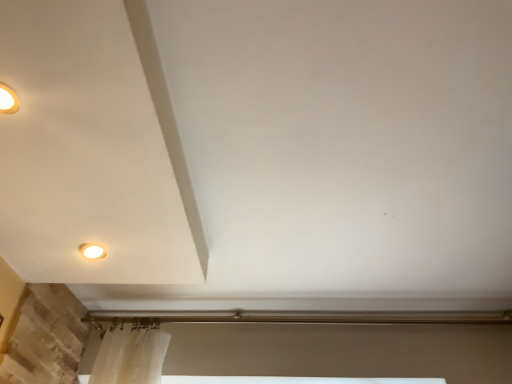
In order to face white glossy light fixture at upper left, should I rotate leftwards or rightwards?

It's best to rotate left around 30.894 degrees.

What are the coordinates of `white glossy light fixture at upper left` in the screenshot? It's located at (8, 100).

What do you see at coordinates (8, 100) in the screenshot? Image resolution: width=512 pixels, height=384 pixels. I see `white glossy light fixture at upper left` at bounding box center [8, 100].

Identify the location of matte white lamp at lower left. Image resolution: width=512 pixels, height=384 pixels. (92, 251).

What do you see at coordinates (92, 251) in the screenshot? I see `matte white lamp at lower left` at bounding box center [92, 251].

Measure the distance between point (89, 251) and camera.

Point (89, 251) is 1.28 meters away from camera.

You are a GUI agent. You are given a task and a screenshot of the screen. Output one action in this format:
    pyautogui.click(x=<x>, y=<y>)
    Task: Click on the white glossy light fixture at upper left
    
    Given the screenshot: What is the action you would take?
    pyautogui.click(x=8, y=100)

Considering the relative positions of matte white lamp at lower left and white glossy light fixture at upper left in the image provided, is matte white lamp at lower left to the left of white glossy light fixture at upper left from the viewer's perspective?

No, matte white lamp at lower left is not to the left of white glossy light fixture at upper left.

Which object is further away from the camera taking this photo, matte white lamp at lower left or white glossy light fixture at upper left?

matte white lamp at lower left.

Considering the positions of points (87, 250) and (1, 84), is point (87, 250) farther from camera compared to point (1, 84)?

Yes, it is.

From the image's perspective, which one is positioned higher, matte white lamp at lower left or white glossy light fixture at upper left?

white glossy light fixture at upper left, from the image's perspective.

From a real-world perspective, which is physically below, matte white lamp at lower left or white glossy light fixture at upper left?

white glossy light fixture at upper left is physically lower.

In terms of width, does matte white lamp at lower left look wider or thinner when compared to white glossy light fixture at upper left?

Clearly, matte white lamp at lower left has less width compared to white glossy light fixture at upper left.

Consider the image. Can you confirm if matte white lamp at lower left is shorter than white glossy light fixture at upper left?

No, matte white lamp at lower left is not shorter than white glossy light fixture at upper left.

Can you confirm if matte white lamp at lower left is smaller than white glossy light fixture at upper left?

Yes.

Is matte white lamp at lower left spatially inside white glossy light fixture at upper left, or outside of it?

matte white lamp at lower left is spatially situated outside white glossy light fixture at upper left.

Are matte white lamp at lower left and white glossy light fixture at upper left making contact?

No, matte white lamp at lower left is not beside white glossy light fixture at upper left.

Is matte white lamp at lower left looking in the opposite direction of white glossy light fixture at upper left?

No, matte white lamp at lower left's orientation is not away from white glossy light fixture at upper left.

How different are the orientations of matte white lamp at lower left and white glossy light fixture at upper left in degrees?

The angular difference between matte white lamp at lower left and white glossy light fixture at upper left is 0.000519 degrees.

The width and height of the screenshot is (512, 384). I want to click on lighting above the matte white lamp at lower left (from the image's perspective), so click(x=8, y=100).

Which is more to the left, white glossy light fixture at upper left or matte white lamp at lower left?

From the viewer's perspective, white glossy light fixture at upper left appears more on the left side.

Considering the positions of objects white glossy light fixture at upper left and matte white lamp at lower left in the image provided, who is behind, white glossy light fixture at upper left or matte white lamp at lower left?

matte white lamp at lower left.

Does point (7, 88) come closer to viewer compared to point (92, 257)?

Yes, point (7, 88) is closer to viewer.

From the image's perspective, would you say white glossy light fixture at upper left is positioned over matte white lamp at lower left?

Indeed, from the image's perspective, white glossy light fixture at upper left is shown above matte white lamp at lower left.

From a real-world perspective, is white glossy light fixture at upper left beneath matte white lamp at lower left?

Yes, from a real-world perspective, white glossy light fixture at upper left is beneath matte white lamp at lower left.

Consider the image. Which of these two, white glossy light fixture at upper left or matte white lamp at lower left, is thinner?

matte white lamp at lower left.

From their relative heights in the image, would you say white glossy light fixture at upper left is taller or shorter than matte white lamp at lower left?

Considering their sizes, white glossy light fixture at upper left has less height than matte white lamp at lower left.

Considering the sizes of white glossy light fixture at upper left and matte white lamp at lower left in the image, is white glossy light fixture at upper left bigger or smaller than matte white lamp at lower left?

Considering their sizes, white glossy light fixture at upper left takes up more space than matte white lamp at lower left.

Does white glossy light fixture at upper left contain matte white lamp at lower left?

That's incorrect, matte white lamp at lower left is not inside white glossy light fixture at upper left.

Would you consider white glossy light fixture at upper left to be distant from matte white lamp at lower left?

They are positioned close to each other.

Is white glossy light fixture at upper left oriented towards matte white lamp at lower left?

No, white glossy light fixture at upper left is not oriented towards matte white lamp at lower left.

How different are the orientations of white glossy light fixture at upper left and matte white lamp at lower left in degrees?

They differ by 0.000519 degrees in their facing directions.

The height and width of the screenshot is (384, 512). What are the coordinates of `lamp located behind the white glossy light fixture at upper left` in the screenshot? It's located at (92, 251).

Find the location of a particular element. The height and width of the screenshot is (384, 512). lamp located behind the white glossy light fixture at upper left is located at coordinates (92, 251).

The width and height of the screenshot is (512, 384). In order to click on lighting below the matte white lamp at lower left (from a real-world perspective) in this screenshot , I will do `click(8, 100)`.